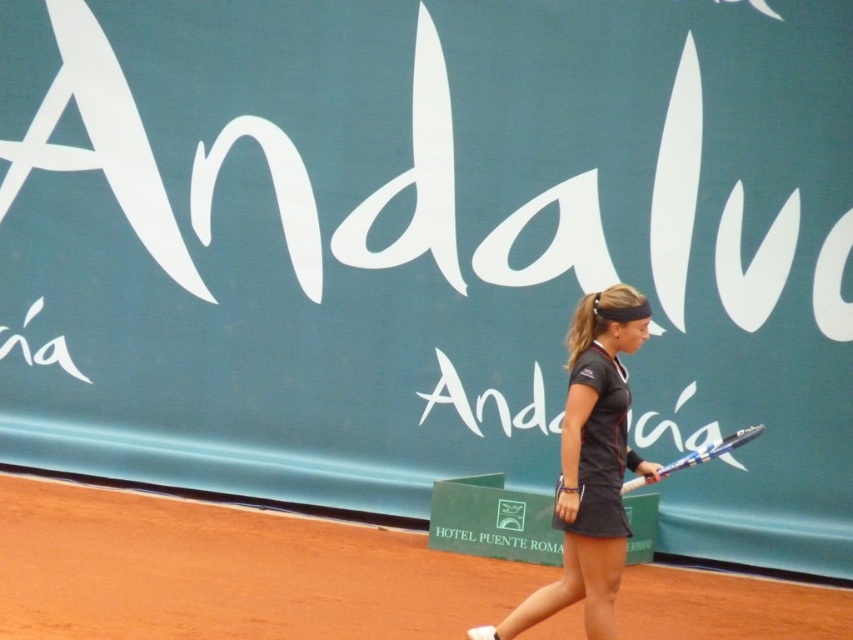
Question: Which of the following is the farthest from the observer?

Choices:
 (A) (601, 376)
 (B) (759, 433)

Answer: (B)

Question: Based on their relative distances, which object is nearer to the dark gray fabric tennis outfit at center?

Choices:
 (A) blue metallic racket at center
 (B) brown clay tennis court at center

Answer: (A)

Question: Considering the relative positions of dark gray fabric tennis outfit at center and blue metallic racket at center in the image provided, where is dark gray fabric tennis outfit at center located with respect to blue metallic racket at center?

Choices:
 (A) left
 (B) right

Answer: (A)

Question: Does brown clay tennis court at center appear over blue metallic racket at center?

Choices:
 (A) no
 (B) yes

Answer: (A)

Question: Which object appears farthest from the camera in this image?

Choices:
 (A) dark gray fabric tennis outfit at center
 (B) blue metallic racket at center
 (C) brown clay tennis court at center

Answer: (C)

Question: Can you confirm if brown clay tennis court at center is positioned below dark gray fabric tennis outfit at center?

Choices:
 (A) no
 (B) yes

Answer: (B)